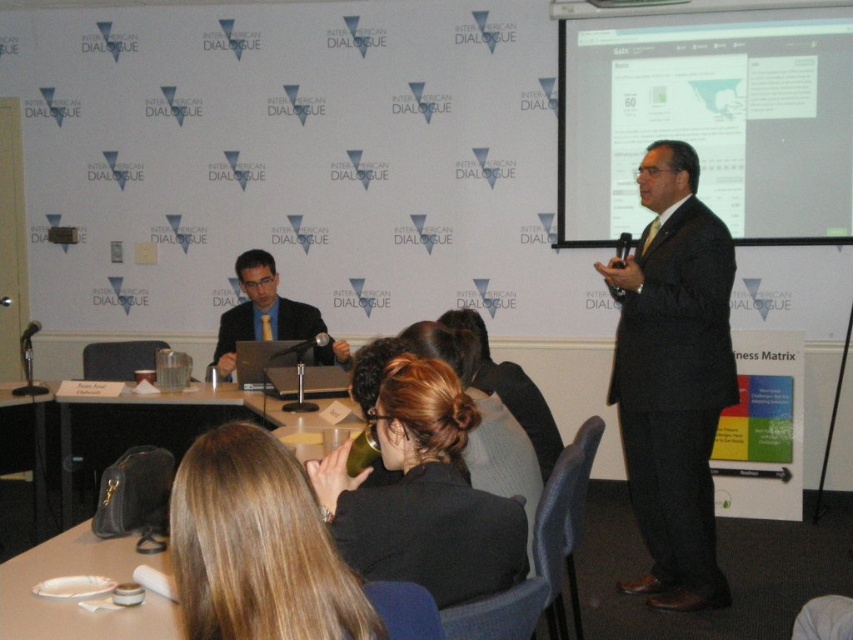
Question: Which of these objects is positioned farthest from the matte black jacket at center?

Choices:
 (A) matte white projector screen at upper right
 (B) brown hair at center

Answer: (A)

Question: Can you confirm if matte white projector screen at upper right is positioned below dark gray suit at center?

Choices:
 (A) yes
 (B) no

Answer: (B)

Question: Which of the following is the closest to the observer?

Choices:
 (A) dark gray suit at center
 (B) matte black jacket at center
 (C) matte black suit at center

Answer: (B)

Question: Which point is closer to the camera?

Choices:
 (A) (264, 260)
 (B) (115, 570)
 (C) (107, 420)
 (D) (425, 428)

Answer: (D)

Question: Can you confirm if white plastic plate at lower left is bigger than black leather table at lower left?

Choices:
 (A) no
 (B) yes

Answer: (A)

Question: Considering the relative positions of brown hair at center and white plastic plate at lower left in the image provided, where is brown hair at center located with respect to white plastic plate at lower left?

Choices:
 (A) above
 (B) below

Answer: (A)